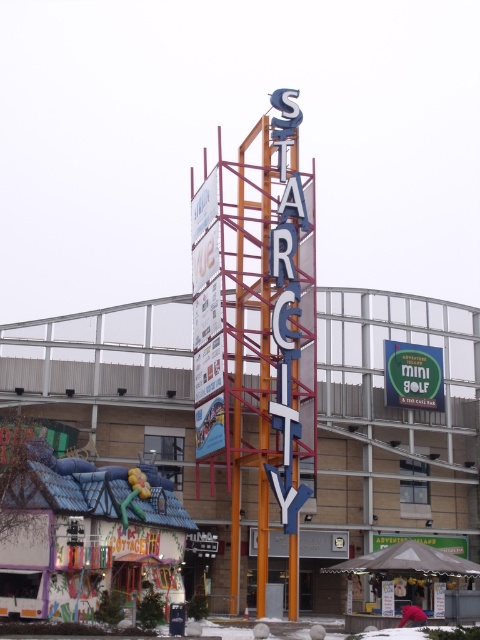
You are a city planner reviewing the layout of Star City. You need to ensure that the green matte mini golf sign at center is visible from the main road. Given that the metallic blue sign at center is in front of it, does the height difference between them pose a visibility issue?

The metallic blue sign at center is taller than the green matte mini golf sign at center, so it may block the view of the mini golf sign from the main road due to its greater height.

You are standing in the middle of the STAR CITY area and see the metallic blue sign at center and the green matte mini golf sign at center. Which one is positioned to the left?

The metallic blue sign at center is positioned to the left of the green matte mini golf sign at center.

You are standing in the middle of the scene. Where is the metallic blue sign at center located in terms of direction and distance?

The metallic blue sign at center is located at the coordinates point (392, 428), which is to the lower right direction and at a moderate distance from your current position.